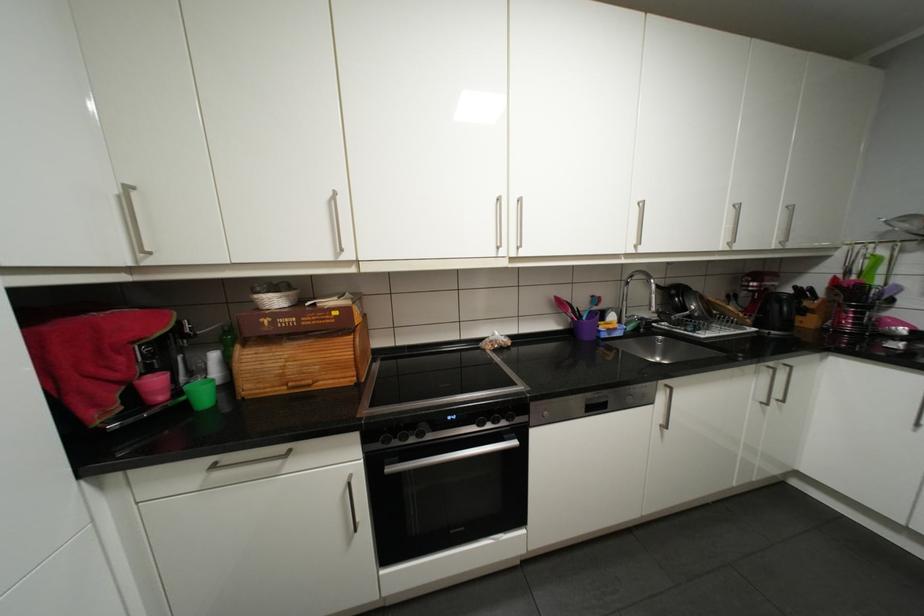
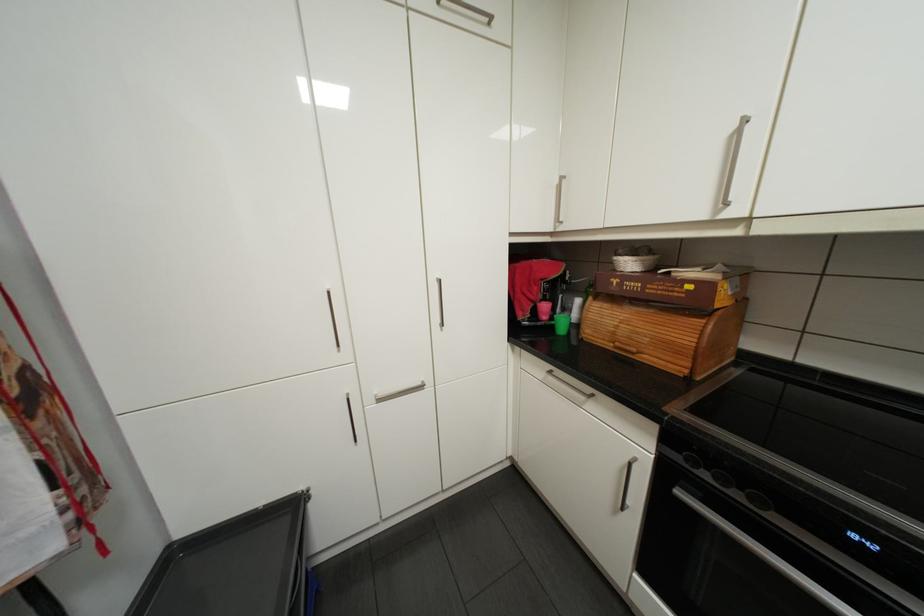
Find the pixel in the second image that matches (251,344) in the first image.

(602, 297)